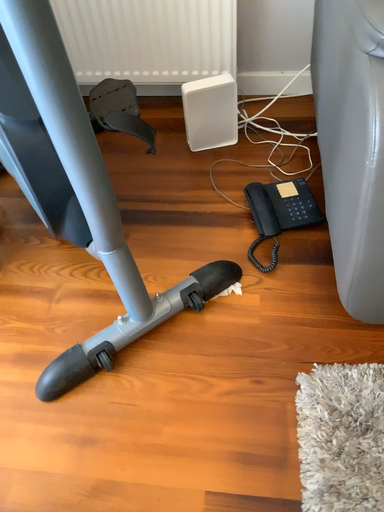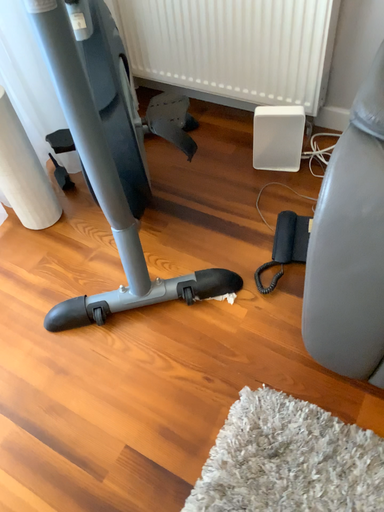
Question: Which way did the camera rotate in the video?

Choices:
 (A) rotated left
 (B) rotated right

Answer: (A)